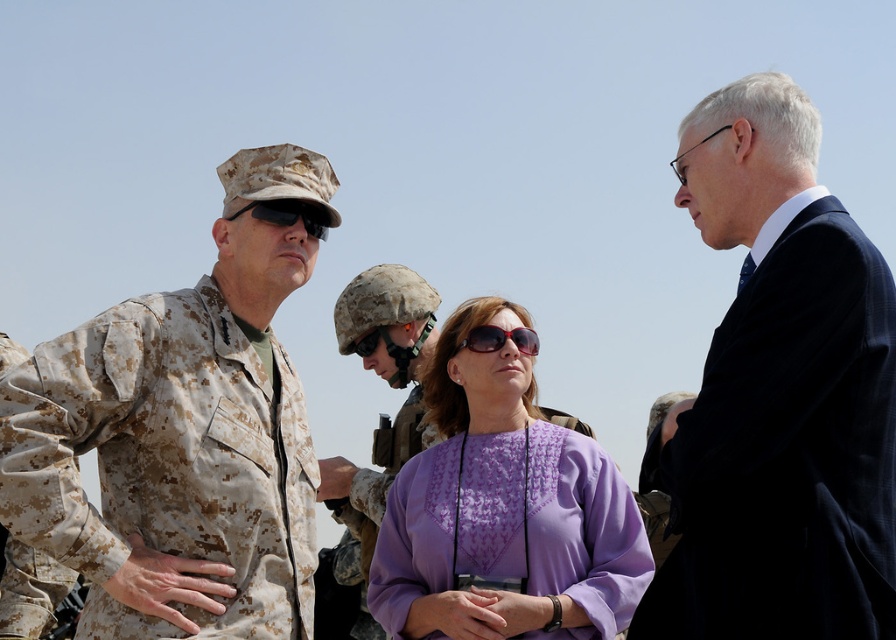
You are an observer trying to determine the spatial arrangement of the clothing items in the scene. Given that you can see both the camouflage uniform at left and the purple fabric blouse at center, which of these two items appears wider from your perspective?

The camouflage uniform at left has a lesser width compared to the purple fabric blouse at center, so the purple fabric blouse at center appears wider from the observer perspective.